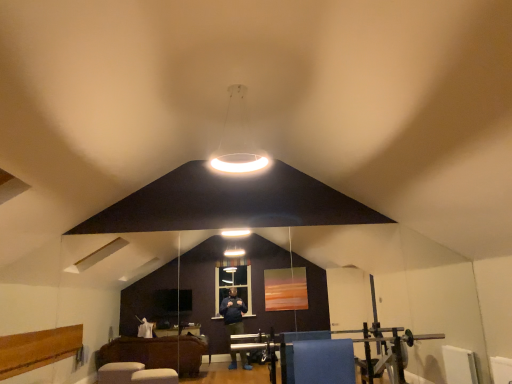
Locate an element on the screen. Image resolution: width=512 pixels, height=384 pixels. white glossy ring light at center is located at coordinates coord(238,138).

This screenshot has height=384, width=512. What do you see at coordinates (238, 138) in the screenshot?
I see `white glossy ring light at center` at bounding box center [238, 138].

Find the location of a particular element. This screenshot has width=512, height=384. blue fabric at lower center is located at coordinates (324, 361).

What do you see at coordinates (324, 361) in the screenshot?
I see `blue fabric at lower center` at bounding box center [324, 361].

Where is `white glossy ring light at center`? This screenshot has height=384, width=512. white glossy ring light at center is located at coordinates click(x=238, y=138).

Does blue fabric at lower center appear on the left side of white glossy ring light at center?

In fact, blue fabric at lower center is to the right of white glossy ring light at center.

Which is behind, blue fabric at lower center or white glossy ring light at center?

blue fabric at lower center is more distant.

Between point (303, 378) and point (232, 106), which one is positioned behind?

The point (303, 378) is behind.

From the image's perspective, does blue fabric at lower center appear higher than white glossy ring light at center?

No, from the image's perspective, blue fabric at lower center is not on top of white glossy ring light at center.

From a real-world perspective, between blue fabric at lower center and white glossy ring light at center, who is vertically higher?

From a 3D spatial view, white glossy ring light at center is above.

Looking at this image, which of these two, blue fabric at lower center or white glossy ring light at center, is wider?

Wider between the two is white glossy ring light at center.

Can you confirm if blue fabric at lower center is shorter than white glossy ring light at center?

Indeed, blue fabric at lower center has a lesser height compared to white glossy ring light at center.

Which of these two, blue fabric at lower center or white glossy ring light at center, is bigger?

white glossy ring light at center is bigger.

Is white glossy ring light at center a part of blue fabric at lower center?

No, white glossy ring light at center is not surrounded by blue fabric at lower center.

Is blue fabric at lower center beside white glossy ring light at center?

No, blue fabric at lower center is not touching white glossy ring light at center.

Does blue fabric at lower center turn towards white glossy ring light at center?

No, blue fabric at lower center is not turned towards white glossy ring light at center.

How different are the orientations of blue fabric at lower center and white glossy ring light at center in degrees?

3.18 degrees.

How far apart are blue fabric at lower center and white glossy ring light at center?

blue fabric at lower center and white glossy ring light at center are 7.63 feet apart.

Identify the location of furniture below the white glossy ring light at center (from the image's perspective). (324, 361).

From the picture: Can you confirm if white glossy ring light at center is positioned to the left of blue fabric at lower center?

Correct, you'll find white glossy ring light at center to the left of blue fabric at lower center.

Relative to blue fabric at lower center, is white glossy ring light at center in front or behind?

Visually, white glossy ring light at center is located in front of blue fabric at lower center.

Which is in front, point (215, 168) or point (348, 365)?

The point (348, 365) is in front.

From the image's perspective, between white glossy ring light at center and blue fabric at lower center, who is located below?

From the image's view, blue fabric at lower center is below.

From a real-world perspective, is white glossy ring light at center beneath blue fabric at lower center?

No, from a real-world perspective, white glossy ring light at center is not beneath blue fabric at lower center.

Which of these two, white glossy ring light at center or blue fabric at lower center, is wider?

Wider between the two is white glossy ring light at center.

Between white glossy ring light at center and blue fabric at lower center, which one has less height?

blue fabric at lower center is shorter.

Between white glossy ring light at center and blue fabric at lower center, which one has smaller size?

blue fabric at lower center.

Is white glossy ring light at center outside of blue fabric at lower center?

white glossy ring light at center lies outside blue fabric at lower center's area.

Can you see white glossy ring light at center touching blue fabric at lower center?

No.

Is blue fabric at lower center at the back of white glossy ring light at center?

No, white glossy ring light at center is not facing the opposite direction of blue fabric at lower center.

How many degrees apart are the facing directions of white glossy ring light at center and blue fabric at lower center?

They differ by 3.18 degrees in their facing directions.

The width and height of the screenshot is (512, 384). Find the location of `furniture below the white glossy ring light at center (from a real-world perspective)`. furniture below the white glossy ring light at center (from a real-world perspective) is located at coordinates (324, 361).

Identify the location of furniture lying below the white glossy ring light at center (from the image's perspective). The width and height of the screenshot is (512, 384). (324, 361).

This screenshot has width=512, height=384. What are the coordinates of `furniture on the right of the white glossy ring light at center` in the screenshot? It's located at (324, 361).